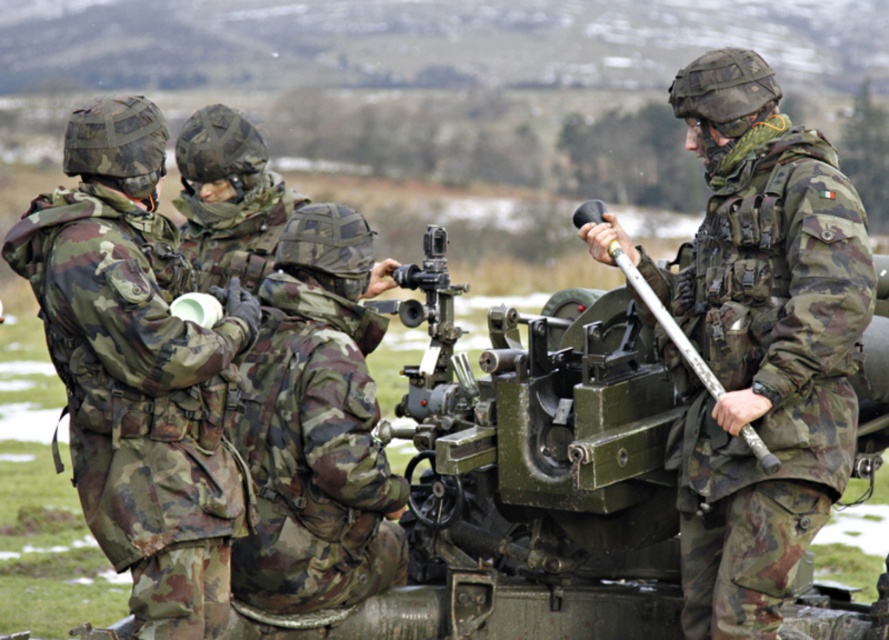
Question: Does camouflage fabric helmet at upper right appear over metallic green gun at right?

Choices:
 (A) no
 (B) yes

Answer: (A)

Question: Which object appears farthest from the camera in this image?

Choices:
 (A) metallic green gun at right
 (B) camouflage fabric helmet at center
 (C) camouflage fabric helmet at upper right
 (D) camouflage fabric helmet at upper left

Answer: (B)

Question: Does camouflage fabric helmet at upper left lie behind metallic green gun at right?

Choices:
 (A) yes
 (B) no

Answer: (A)

Question: Does camouflage fabric helmet at upper right have a greater width compared to camouflage fabric helmet at center?

Choices:
 (A) no
 (B) yes

Answer: (B)

Question: Which of the following is the closest to the observer?

Choices:
 (A) (851, 406)
 (B) (758, 442)

Answer: (B)

Question: Among these points, which one is farthest from the camera?

Choices:
 (A) (127, 276)
 (B) (645, 275)

Answer: (B)